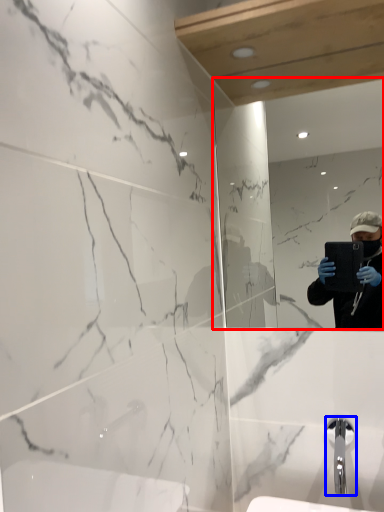
Question: Which object is further to the camera taking this photo, mirror (highlighted by a red box) or tap (highlighted by a blue box)?

Choices:
 (A) mirror
 (B) tap

Answer: (A)